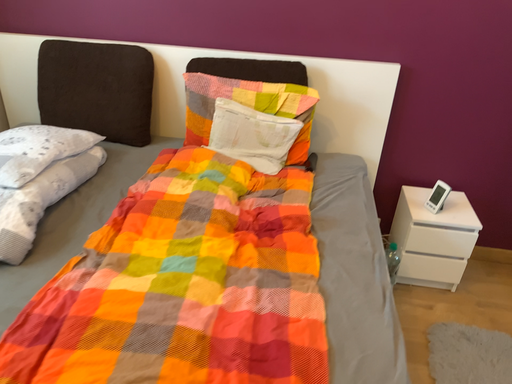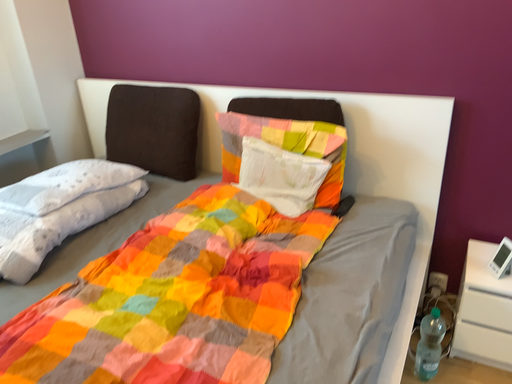
Question: Which way did the camera rotate in the video?

Choices:
 (A) rotated right
 (B) rotated left

Answer: (B)